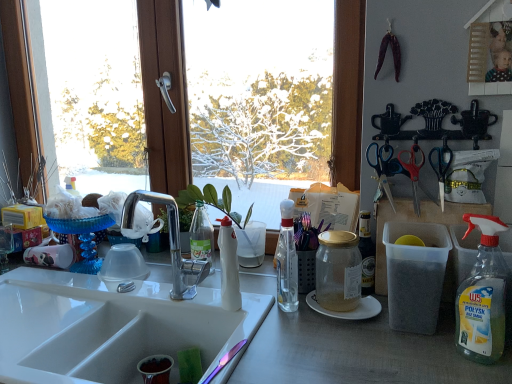
Where is `vacant area on top of white ceramic sink at center (from a real-world perspective)`? The height and width of the screenshot is (384, 512). vacant area on top of white ceramic sink at center (from a real-world perspective) is located at coordinates (67, 301).